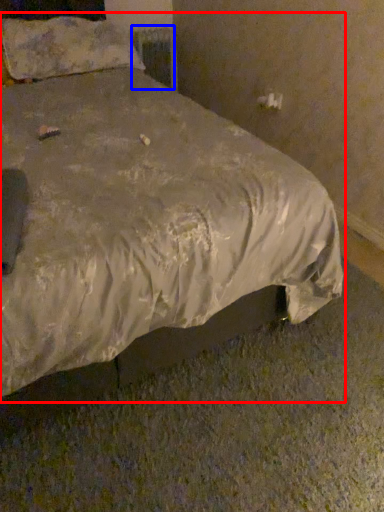
Question: Which object appears farthest to the camera in this image, bed (highlighted by a red box) or radiator (highlighted by a blue box)?

Choices:
 (A) bed
 (B) radiator

Answer: (B)